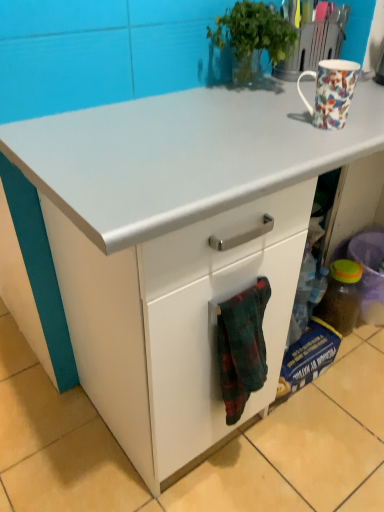
You are a GUI agent. You are given a task and a screenshot of the screen. Output one action in this format:
    pyautogui.click(x=<x>, y=<y>)
    Task: Click on the free spot to the right of floral porcelain mug at upper right
    
    Given the screenshot: What is the action you would take?
    pyautogui.click(x=365, y=121)